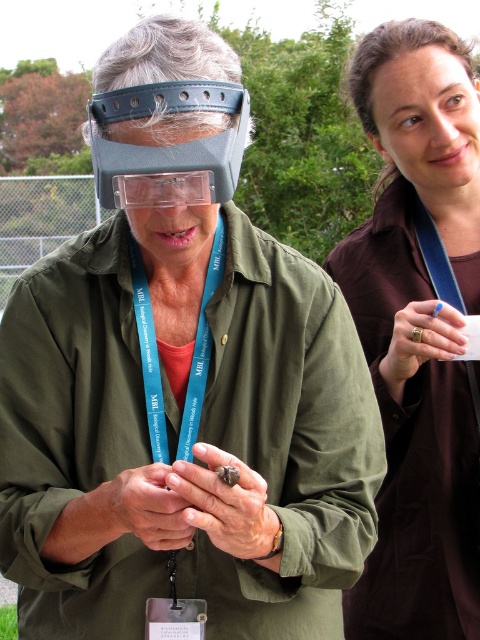
You are a participant at an event and need to locate your assigned goggles. According to the image, where exactly are the matte plastic goggles at center located?

The matte plastic goggles at center are located at point [168,147].

You are standing in front of the two people in the image. You need to determine which of the two points, point (456, 589) or point (223, 141), is closer to you. Which one is closer?

Point (456, 589) is closer to you because it is further to the viewer than point (223, 141).

You are an event organizer checking safety equipment. You notice the matte plastic goggles at center and the teal fabric lanyard at center. Which item has a greater width?

The matte plastic goggles at center has a greater width than the teal fabric lanyard at center.